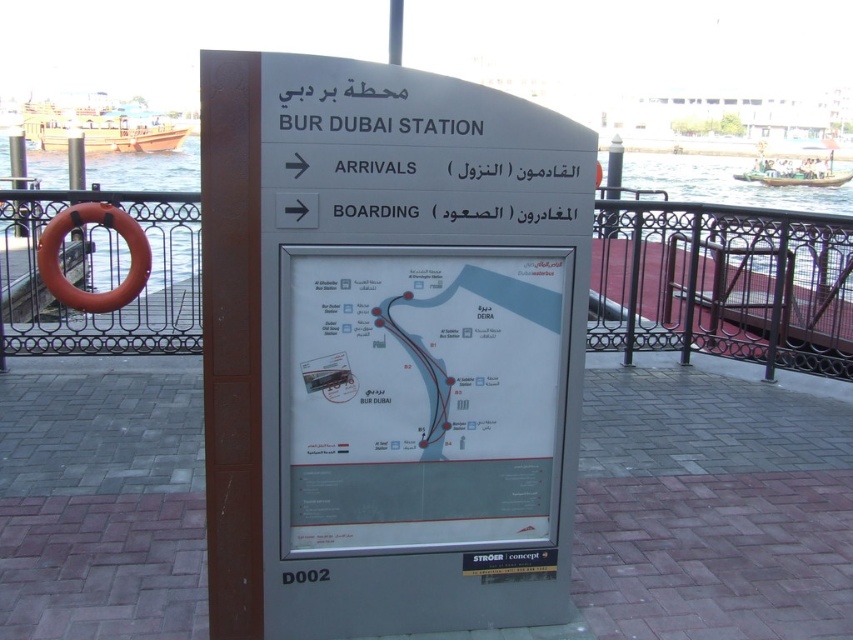
Can you confirm if black metal railing at right is smaller than orange rubber ring at left?

No, black metal railing at right is not smaller than orange rubber ring at left.

Can you confirm if black metal railing at right is wider than orange rubber ring at left?

Indeed, black metal railing at right has a greater width compared to orange rubber ring at left.

Which is in front, point (770, 266) or point (71, 253)?

Point (770, 266) is more forward.

You are a GUI agent. You are given a task and a screenshot of the screen. Output one action in this format:
    pyautogui.click(x=<x>, y=<y>)
    Task: Click on the black metal railing at right
    
    Given the screenshot: What is the action you would take?
    pyautogui.click(x=723, y=284)

Is white plastic sign at center above black metal railing at right?

No.

Which is below, white plastic sign at center or black metal railing at right?

white plastic sign at center is below.

The width and height of the screenshot is (853, 640). What do you see at coordinates (387, 348) in the screenshot?
I see `white plastic sign at center` at bounding box center [387, 348].

The width and height of the screenshot is (853, 640). I want to click on white plastic sign at center, so click(387, 348).

From the picture: Can you confirm if white paper map at center is wider than orange rubber ring at left?

Yes.

Can you confirm if white paper map at center is taller than orange rubber ring at left?

Yes.

At what (x,y) coordinates should I click in order to perform the action: click on white paper map at center. Please return your answer as a coordinate pair (x, y). The image size is (853, 640). Looking at the image, I should click on (421, 394).